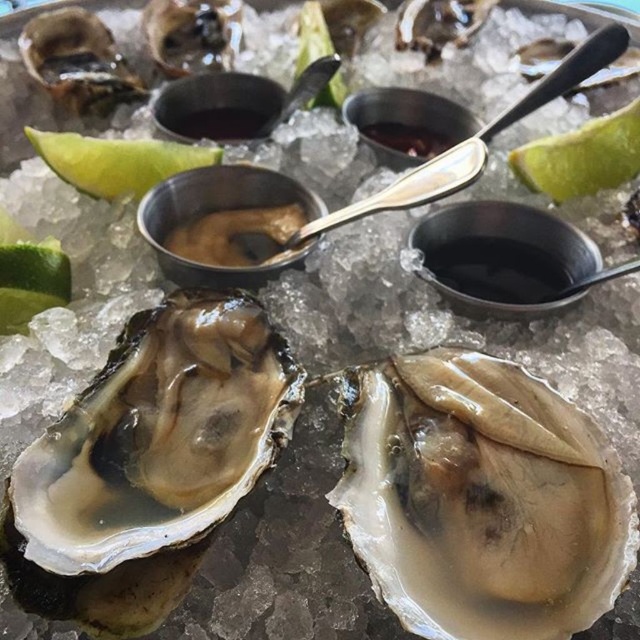
Question: Can you confirm if translucent shell oyster at center is positioned to the right of green matte lime at upper left?

Choices:
 (A) yes
 (B) no

Answer: (A)

Question: Estimate the real-world distances between objects in this image. Which object is farther from the shiny brown oyster at upper left?

Choices:
 (A) green matte lime at upper left
 (B) shiny brown shell at upper left
 (C) translucent shell oyster at center

Answer: (C)

Question: Which of the following is the farthest from the observer?

Choices:
 (A) translucent shell oyster at center
 (B) green matte lime at upper right
 (C) shiny pearl oyster at center
 (D) shiny brown oyster at upper left

Answer: (D)

Question: Is the position of shiny brown shell at upper left less distant than that of green matte lime at upper right?

Choices:
 (A) yes
 (B) no

Answer: (B)

Question: Is translucent shell oyster at center below shiny brown oyster at upper left?

Choices:
 (A) yes
 (B) no

Answer: (A)

Question: Estimate the real-world distances between objects in this image. Which object is farther from the shiny pearl oyster at center?

Choices:
 (A) shiny brown oyster at upper left
 (B) translucent shell oyster at center
 (C) green matte lime at upper left

Answer: (A)